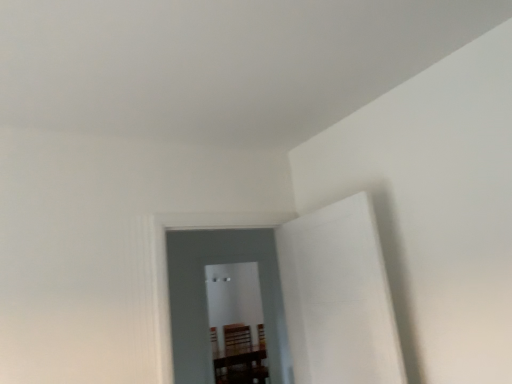
Question: Is transparent glass door at center, placed as the second glass door when sorted from back to front, inside or outside of transparent glass door at center, marked as the 2th glass door in a front-to-back arrangement?

Choices:
 (A) inside
 (B) outside

Answer: (B)

Question: From a real-world perspective, is transparent glass door at center, placed as the second glass door when sorted from back to front, physically located above or below transparent glass door at center, which is counted as the first glass door, starting from the back?

Choices:
 (A) above
 (B) below

Answer: (A)

Question: Is point (166, 235) closer or farther from the camera than point (223, 347)?

Choices:
 (A) farther
 (B) closer

Answer: (B)

Question: From the image's perspective, is transparent glass door at center, marked as the 2th glass door in a front-to-back arrangement, positioned above or below transparent glass door at center, the first glass door positioned from the front?

Choices:
 (A) above
 (B) below

Answer: (B)

Question: Is transparent glass door at center, marked as the 2th glass door in a front-to-back arrangement, wider or thinner than transparent glass door at center, the first glass door positioned from the front?

Choices:
 (A) wide
 (B) thin

Answer: (A)

Question: From a real-world perspective, is transparent glass door at center, which is counted as the first glass door, starting from the back, physically located above or below transparent glass door at center, the first glass door positioned from the front?

Choices:
 (A) below
 (B) above

Answer: (A)

Question: Looking at the image, does transparent glass door at center, which is counted as the first glass door, starting from the back, seem bigger or smaller compared to transparent glass door at center, placed as the second glass door when sorted from back to front?

Choices:
 (A) small
 (B) big

Answer: (B)